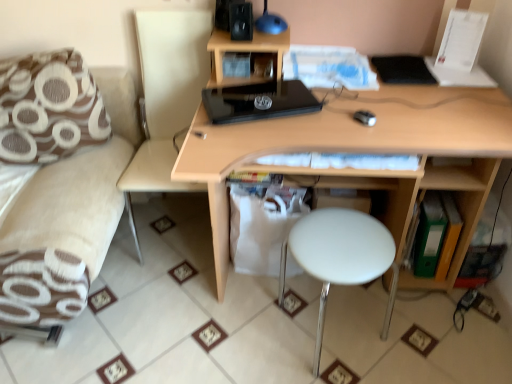
Locate an element on the screen. This screenshot has width=512, height=384. vacant area that lies to the right of white glossy stool at center is located at coordinates (421, 334).